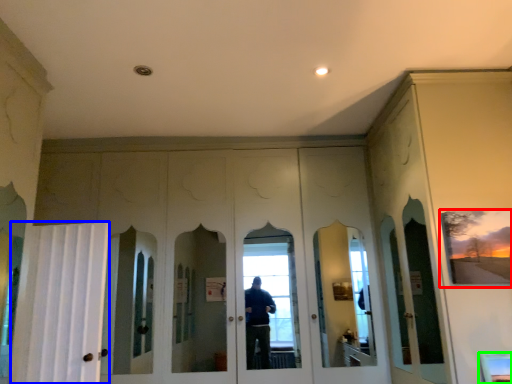
Question: Which is nearer to the picture frame (highlighted by a red box)? curtain (highlighted by a blue box) or window (highlighted by a green box).

Choices:
 (A) curtain
 (B) window

Answer: (B)